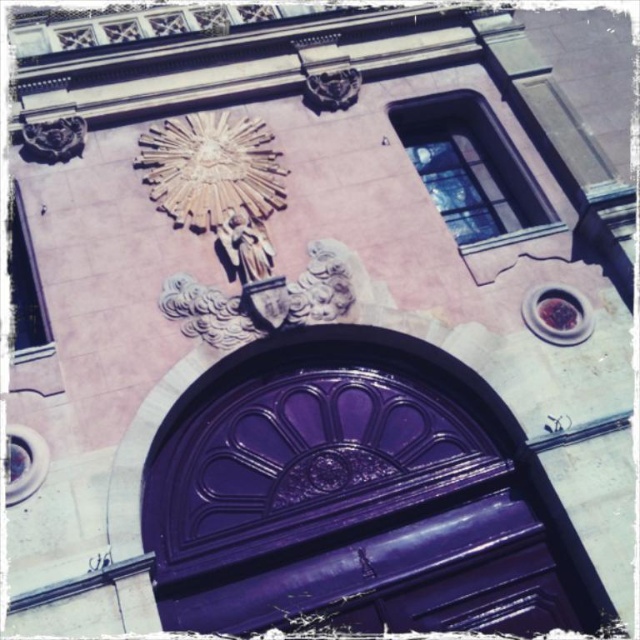
Is gold metallic clock at upper center below white stone statue at center?

Incorrect, gold metallic clock at upper center is not positioned below white stone statue at center.

Which is more to the left, gold metallic clock at upper center or white stone statue at center?

From the viewer's perspective, gold metallic clock at upper center appears more on the left side.

Between point (205, 157) and point (307, 285), which one is positioned behind?

The point (205, 157) is more distant.

Identify the location of gold metallic clock at upper center. (211, 168).

Does point (202, 115) come closer to viewer compared to point (243, 273)?

No.

This screenshot has height=640, width=640. Describe the element at coordinates (211, 168) in the screenshot. I see `gold metallic clock at upper center` at that location.

At what (x,y) coordinates should I click in order to perform the action: click on gold metallic clock at upper center. Please return your answer as a coordinate pair (x, y). The image size is (640, 640). Looking at the image, I should click on (211, 168).

Which of these two, glossy purple door at center or gold metallic clock at upper center, stands shorter?

gold metallic clock at upper center

Is point (273, 522) closer to viewer compared to point (285, 196)?

Yes, it is.

Which is behind, point (486, 461) or point (198, 124)?

The point (198, 124) is behind.

This screenshot has height=640, width=640. Find the location of `glossy purple door at center`. glossy purple door at center is located at coordinates (356, 497).